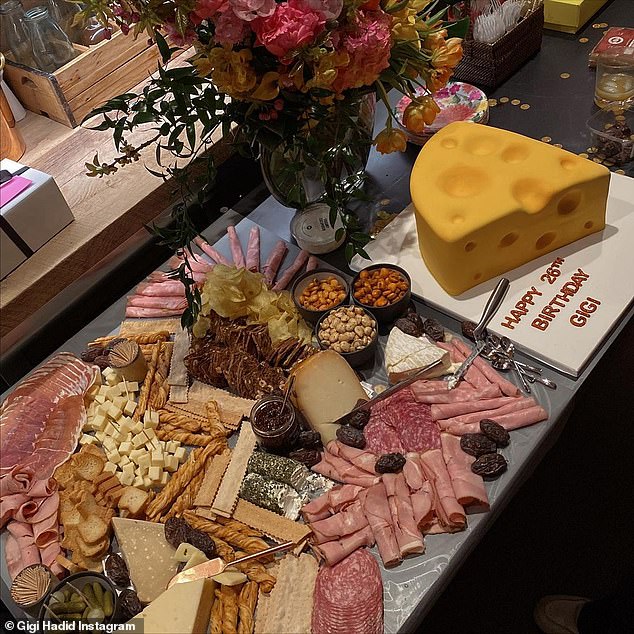
This screenshot has width=634, height=634. In order to click on vase in this screenshot , I will do `click(18, 35)`, `click(49, 42)`, `click(300, 189)`, `click(365, 107)`.